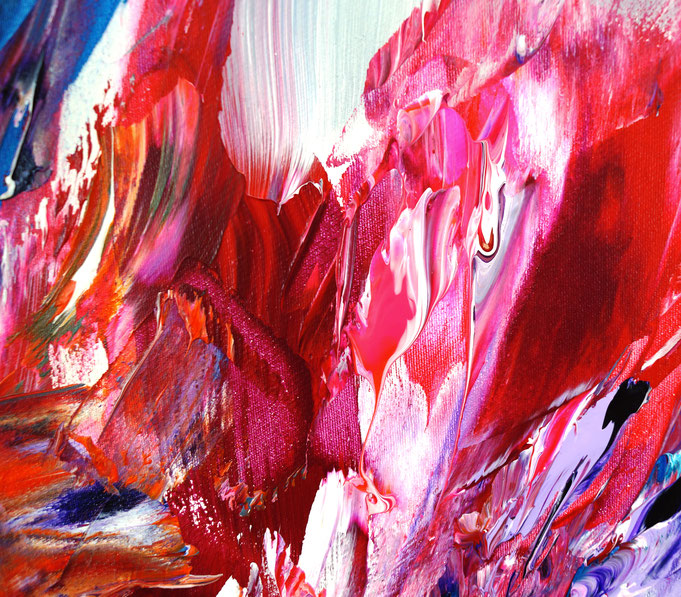
In order to click on green paint in this screenshot , I will do `click(43, 322)`, `click(52, 330)`.